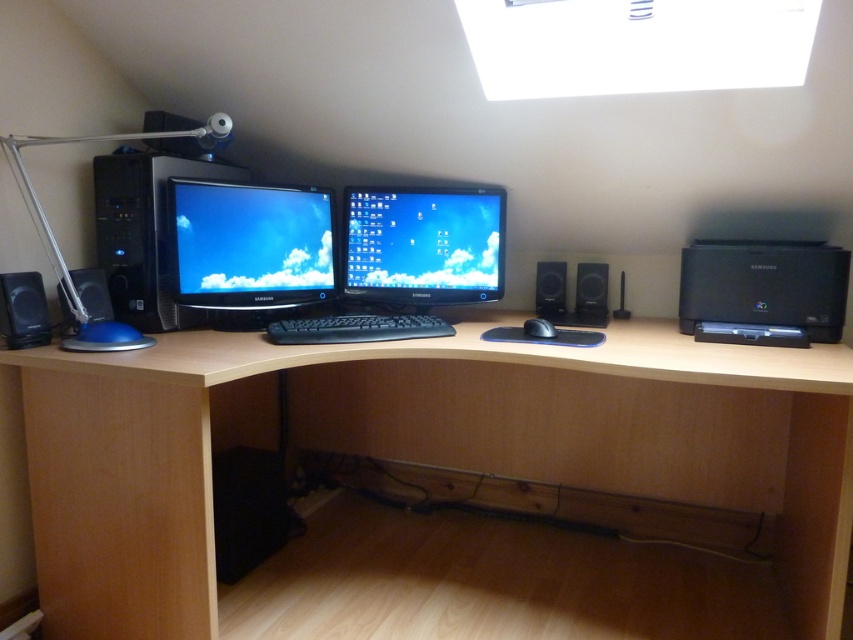
Between black plastic desktop computer at left and black plastic speaker at right, which one has more height?

With more height is black plastic desktop computer at left.

Which is more to the left, black plastic desktop computer at left or black plastic speaker at right?

Positioned to the left is black plastic desktop computer at left.

Find the location of a particular element. The width and height of the screenshot is (853, 640). black plastic desktop computer at left is located at coordinates (144, 234).

The width and height of the screenshot is (853, 640). I want to click on black plastic desktop computer at left, so click(144, 234).

Can you confirm if black plastic printer at right is smaller than black matte speaker at center?

No, black plastic printer at right is not smaller than black matte speaker at center.

Does black plastic printer at right have a larger size compared to black matte speaker at center?

Indeed, black plastic printer at right has a larger size compared to black matte speaker at center.

Is point (723, 260) positioned before point (543, 298)?

Yes, it is in front of point (543, 298).

At what (x,y) coordinates should I click in order to perform the action: click on black plastic printer at right. Please return your answer as a coordinate pair (x, y). This screenshot has width=853, height=640. Looking at the image, I should click on (764, 285).

Who is more distant from viewer, (428, 394) or (561, 289)?

The point (428, 394) is more distant.

Is light brown wood computer desk at center thinner than black matte speaker at center?

No.

Is point (816, 515) more distant than point (563, 275)?

That is False.

The width and height of the screenshot is (853, 640). I want to click on light brown wood computer desk at center, so click(418, 445).